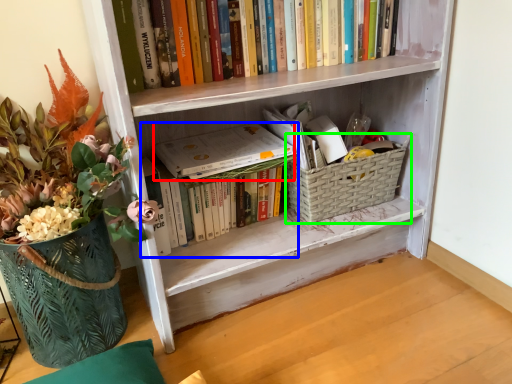
Question: Estimate the real-world distances between objects in this image. Which object is farther from paperback book (highlighted by a red box), book (highlighted by a blue box) or basket container (highlighted by a green box)?

Choices:
 (A) book
 (B) basket container

Answer: (B)